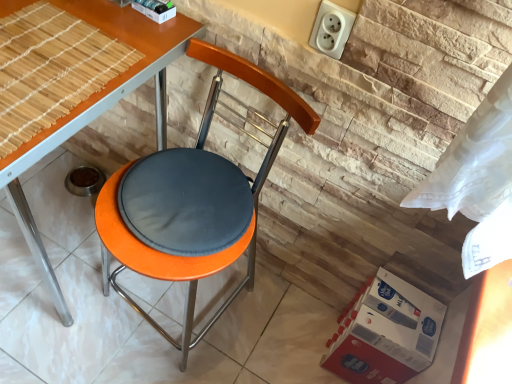
This screenshot has height=384, width=512. I want to click on orange fabric-covered chair at center, so click(197, 191).

Describe the element at coordinates (155, 258) in the screenshot. I see `orange matte stool at center` at that location.

Where is `bamboo mat at upper left`? Image resolution: width=512 pixels, height=384 pixels. bamboo mat at upper left is located at coordinates (51, 69).

Where is `orange matte table at center`? The image size is (512, 384). orange matte table at center is located at coordinates (98, 108).

Where is `white plastic socket at upper right`? This screenshot has height=384, width=512. white plastic socket at upper right is located at coordinates (331, 29).

This screenshot has height=384, width=512. Identify the location of orange fabric-covered chair at center. (197, 191).

Locate an element on the screen. This screenshot has width=512, height=384. mat positioned vertically above the orange matte table at center (from a real-world perspective) is located at coordinates (51, 69).

Which is in front, orange matte table at center or bamboo mat at upper left?

orange matte table at center.

Based on their positions, is orange matte table at center located to the left or right of bamboo mat at upper left?

In the image, orange matte table at center appears on the left side of bamboo mat at upper left.

Is orange matte table at center placed right next to bamboo mat at upper left?

Yes, orange matte table at center is in contact with bamboo mat at upper left.

Which object is thinner, orange matte table at center or red cardboard box at lower right?

With smaller width is red cardboard box at lower right.

Are orange matte table at center and red cardboard box at lower right making contact?

No, orange matte table at center is not beside red cardboard box at lower right.

Looking at this image, is orange matte table at center bigger or smaller than red cardboard box at lower right?

orange matte table at center is bigger than red cardboard box at lower right.

Find the location of `table in front of the red cardboard box at lower right`. table in front of the red cardboard box at lower right is located at coordinates (98, 108).

There is a orange matte table at center. Where is `chair above it (from a real-world perspective)`? This screenshot has width=512, height=384. chair above it (from a real-world perspective) is located at coordinates (197, 191).

Would you say orange matte table at center is part of orange fabric-covered chair at center's contents?

No.

Does orange fabric-covered chair at center appear on the right side of orange matte table at center?

Correct, you'll find orange fabric-covered chair at center to the right of orange matte table at center.

Is there a large distance between orange matte stool at center and bamboo mat at upper left?

No.

How much distance is there between orange matte stool at center and bamboo mat at upper left?

A distance of 28.42 inches exists between orange matte stool at center and bamboo mat at upper left.

Is orange matte stool at center positioned behind bamboo mat at upper left?

Yes, orange matte stool at center is further from the camera.

Does point (174, 341) come in front of point (74, 45)?

No, it is not.

Is the position of orange fabric-covered chair at center less distant than that of bamboo mat at upper left?

Yes.

I want to click on mat above the orange fabric-covered chair at center (from a real-world perspective), so 51,69.

Looking at this image, what's the angular difference between orange fabric-covered chair at center and bamboo mat at upper left's facing directions?

86.2 degrees separate the facing orientations of orange fabric-covered chair at center and bamboo mat at upper left.

Looking at their sizes, would you say orange fabric-covered chair at center is wider or thinner than bamboo mat at upper left?

Clearly, orange fabric-covered chair at center has more width compared to bamboo mat at upper left.

From a real-world perspective, is red cardboard box at lower right physically below bamboo mat at upper left?

Indeed, from a real-world perspective, red cardboard box at lower right is positioned beneath bamboo mat at upper left.

Is the depth of red cardboard box at lower right greater than that of bamboo mat at upper left?

That is True.

Does red cardboard box at lower right turn towards bamboo mat at upper left?

No, red cardboard box at lower right does not turn towards bamboo mat at upper left.

Would you say red cardboard box at lower right is to the left or to the right of bamboo mat at upper left in the picture?

From the image, it's evident that red cardboard box at lower right is to the right of bamboo mat at upper left.

Is bamboo mat at upper left positioned in front of orange matte stool at center?

Yes, it is.

Does bamboo mat at upper left have a larger size compared to orange matte stool at center?

Actually, bamboo mat at upper left might be smaller than orange matte stool at center.

Could you tell me if bamboo mat at upper left is facing orange matte stool at center?

No, bamboo mat at upper left is not oriented towards orange matte stool at center.

The width and height of the screenshot is (512, 384). What are the coordinates of `table below the bamboo mat at upper left (from a real-world perspective)` in the screenshot? It's located at (98, 108).

Identify the location of table above the red cardboard box at lower right (from a real-world perspective). The image size is (512, 384). (98, 108).

Based on their spatial positions, is orange matte table at center or white plastic socket at upper right closer to red cardboard box at lower right?

white plastic socket at upper right.

Looking at the image, which one is located closer to bamboo mat at upper left, orange fabric-covered chair at center or white plastic socket at upper right?

orange fabric-covered chair at center lies closer to bamboo mat at upper left than the other object.

Estimate the real-world distances between objects in this image. Which object is further from orange matte stool at center, orange matte table at center or bamboo mat at upper left?

orange matte table at center lies further to orange matte stool at center than the other object.

Estimate the real-world distances between objects in this image. Which object is further from red cardboard box at lower right, orange matte stool at center or white plastic socket at upper right?

white plastic socket at upper right is further to red cardboard box at lower right.

When comparing their distances from red cardboard box at lower right, does orange fabric-covered chair at center or orange matte stool at center seem closer?

Based on the image, orange matte stool at center appears to be nearer to red cardboard box at lower right.

Which object lies further to the anchor point orange matte table at center, bamboo mat at upper left or orange matte stool at center?

orange matte stool at center is positioned further to the anchor orange matte table at center.

Which object lies nearer to the anchor point orange fabric-covered chair at center, orange matte table at center or orange matte stool at center?

The object closer to orange fabric-covered chair at center is orange matte stool at center.

Considering their positions, is bamboo mat at upper left positioned further to orange matte table at center than orange fabric-covered chair at center?

orange fabric-covered chair at center is positioned further to the anchor orange matte table at center.

Where is `bar stool between orange matte table at center and white plastic socket at upper right`? The image size is (512, 384). bar stool between orange matte table at center and white plastic socket at upper right is located at coordinates (155, 258).

Identify the location of electric outlet situated between orange matte table at center and red cardboard box at lower right from left to right. Image resolution: width=512 pixels, height=384 pixels. (331, 29).

This screenshot has height=384, width=512. In order to click on mat between orange matte table at center and red cardboard box at lower right in the horizontal direction in this screenshot , I will do `click(51, 69)`.

Where is `bar stool located between orange fabric-covered chair at center and red cardboard box at lower right in the left-right direction`? This screenshot has width=512, height=384. bar stool located between orange fabric-covered chair at center and red cardboard box at lower right in the left-right direction is located at coordinates (155, 258).